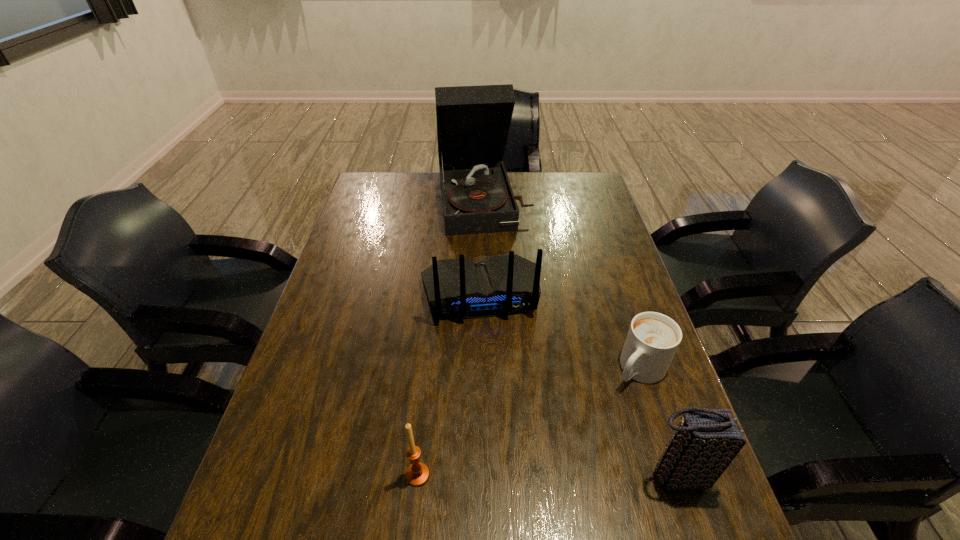
This screenshot has height=540, width=960. In order to click on free space located on the side with the handle of the cappuccino in this screenshot , I will do `click(529, 494)`.

Find the location of a particular element. The height and width of the screenshot is (540, 960). vacant space located on the back of the router is located at coordinates (502, 421).

Where is `free location located on the back of the router`? The height and width of the screenshot is (540, 960). free location located on the back of the router is located at coordinates (493, 370).

At what (x,y) coordinates should I click in order to perform the action: click on free region located on the back of the router. Please return your answer as a coordinate pair (x, y). Looking at the image, I should click on (511, 475).

The width and height of the screenshot is (960, 540). I want to click on free space located 0.350m on the front-facing side of the tallest object, so click(x=506, y=310).

Identify the location of vacant space located on the front-facing side of the tallest object. The image size is (960, 540). (501, 286).

This screenshot has width=960, height=540. I want to click on free space located on the front-facing side of the tallest object, so click(x=498, y=275).

At what (x,y) coordinates should I click in order to perform the action: click on object that is at the far edge. Please return your answer as a coordinate pair (x, y). Looking at the image, I should click on (473, 122).

What are the coordinates of `candle_holder situated at the near edge` in the screenshot? It's located at (417, 475).

Identify the location of clutch bag at the near edge. The image size is (960, 540). (705, 442).